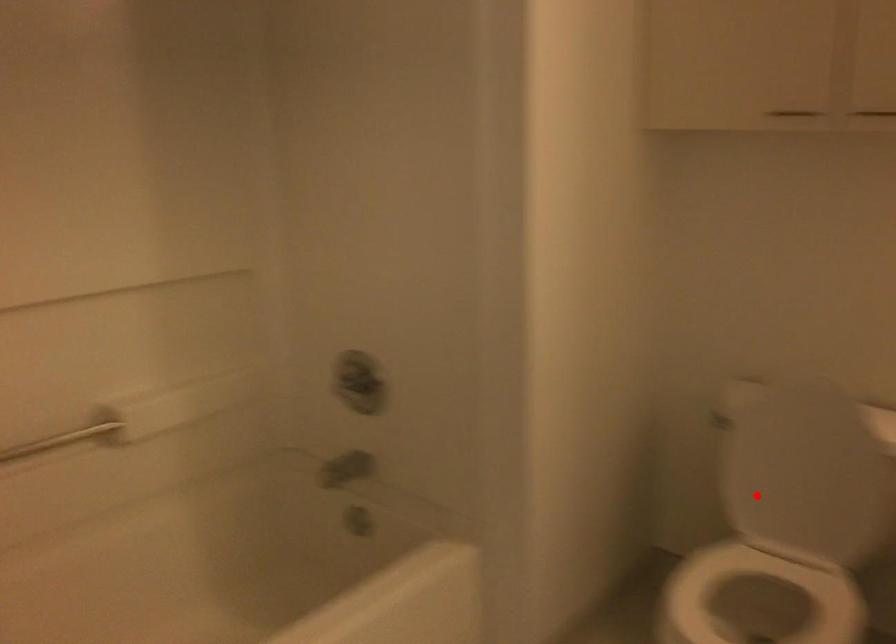
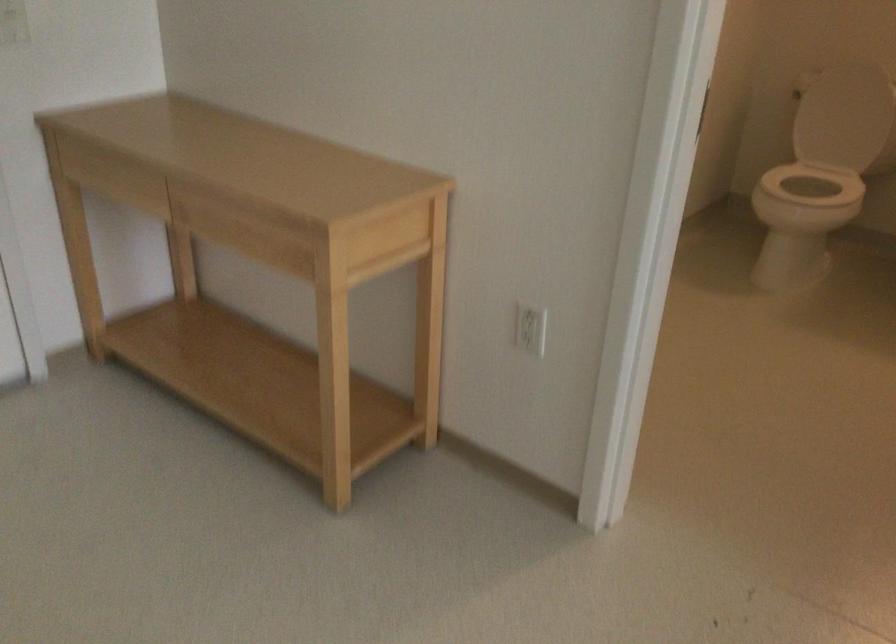
In the second image, find the point that corresponds to the highlighted location in the first image.

(839, 118)